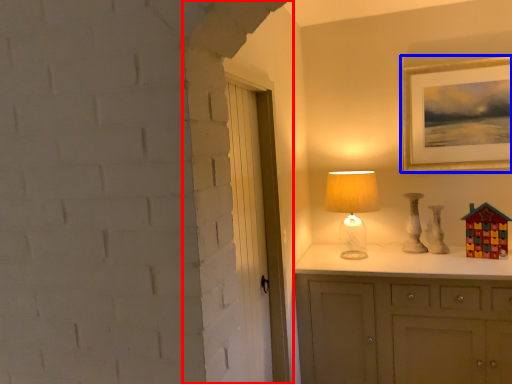
Question: Which of the following is the closest to the observer, door (highlighted by a red box) or picture frame (highlighted by a blue box)?

Choices:
 (A) door
 (B) picture frame

Answer: (A)